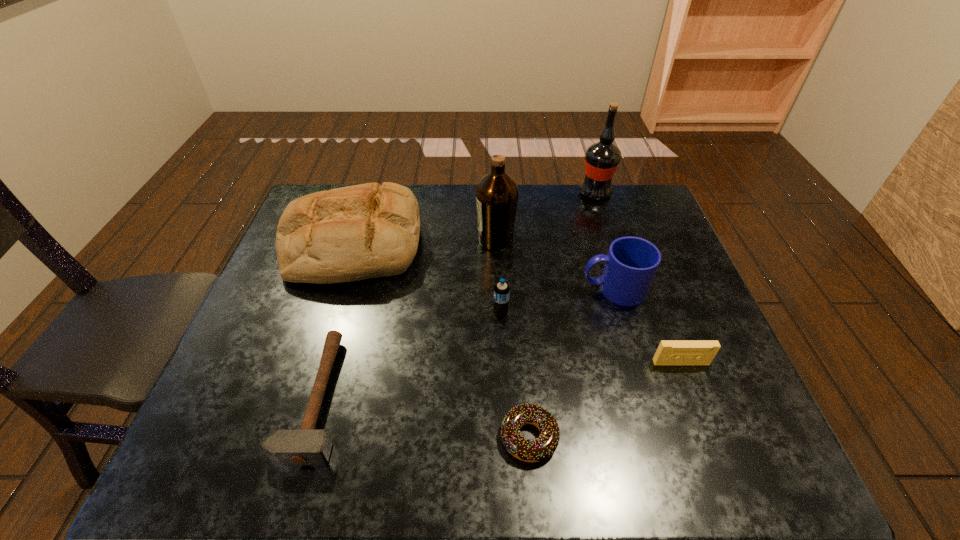
Where is `object located in the near left corner section of the desktop`? The image size is (960, 540). object located in the near left corner section of the desktop is located at coordinates (305, 446).

Find the location of a particular element. Image resolution: width=960 pixels, height=540 pixels. object positioned at the far right corner is located at coordinates (601, 159).

I want to click on free space at the far edge, so coord(521,220).

This screenshot has width=960, height=540. Find the location of `free space at the near edge of the desktop`. free space at the near edge of the desktop is located at coordinates (269, 474).

Locate an element on the screen. This screenshot has height=540, width=960. vacant area at the left edge of the desktop is located at coordinates (300, 340).

In the image, there is a desktop. Where is `vacant region at the right edge`? vacant region at the right edge is located at coordinates (715, 328).

Image resolution: width=960 pixels, height=540 pixels. I want to click on blank space at the far right corner, so click(639, 212).

You are a GUI agent. You are given a task and a screenshot of the screen. Output one action in this format:
    pyautogui.click(x=<x>, y=<y>)
    Task: Click on the free space at the near right corner of the desktop
    
    Given the screenshot: What is the action you would take?
    pyautogui.click(x=717, y=449)

You are a GUI agent. You are given a task and a screenshot of the screen. Output one action in this format:
    pyautogui.click(x=<x>, y=<y>)
    Task: Click on the free point between the farthest object and the mug
    
    Given the screenshot: What is the action you would take?
    pyautogui.click(x=605, y=241)

The image size is (960, 540). Identify the location of empty location between the mug and the fourth nearest object. (558, 301).